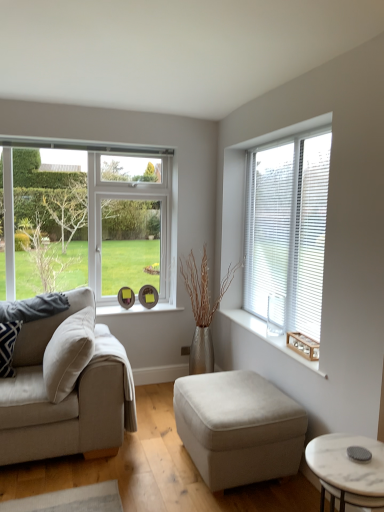
The image size is (384, 512). I want to click on vacant space to the left of beige fabric ottoman at center, so click(144, 466).